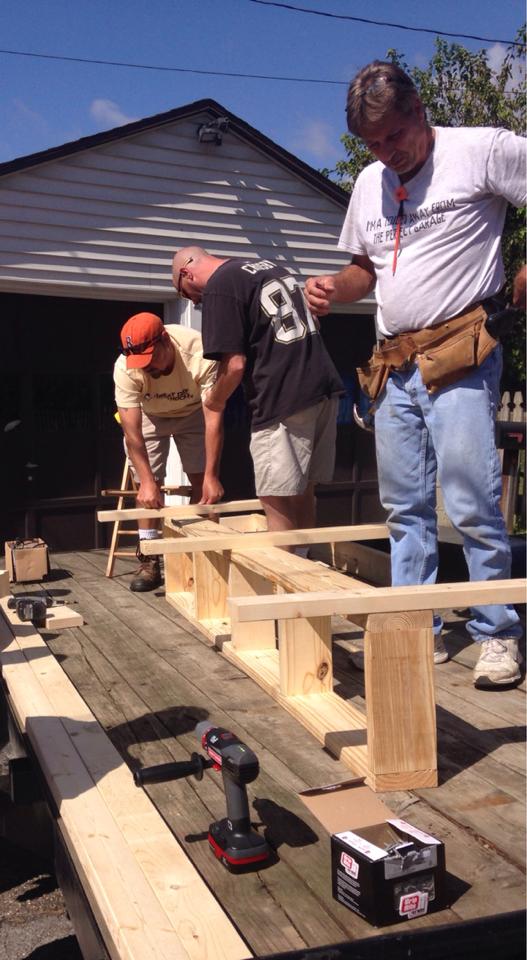
The width and height of the screenshot is (527, 960). Find the location of `lace`. lace is located at coordinates (496, 649).